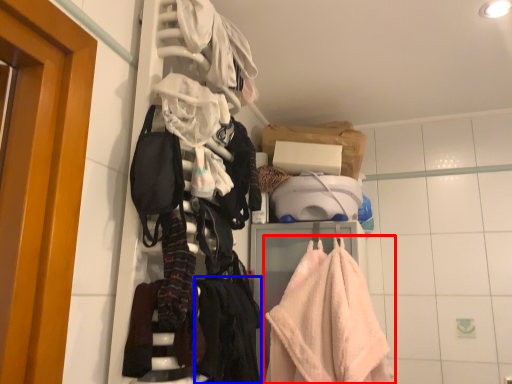
Question: Among these objects, which one is farthest to the camera, towel (highlighted by a red box) or clothing (highlighted by a blue box)?

Choices:
 (A) towel
 (B) clothing

Answer: (A)